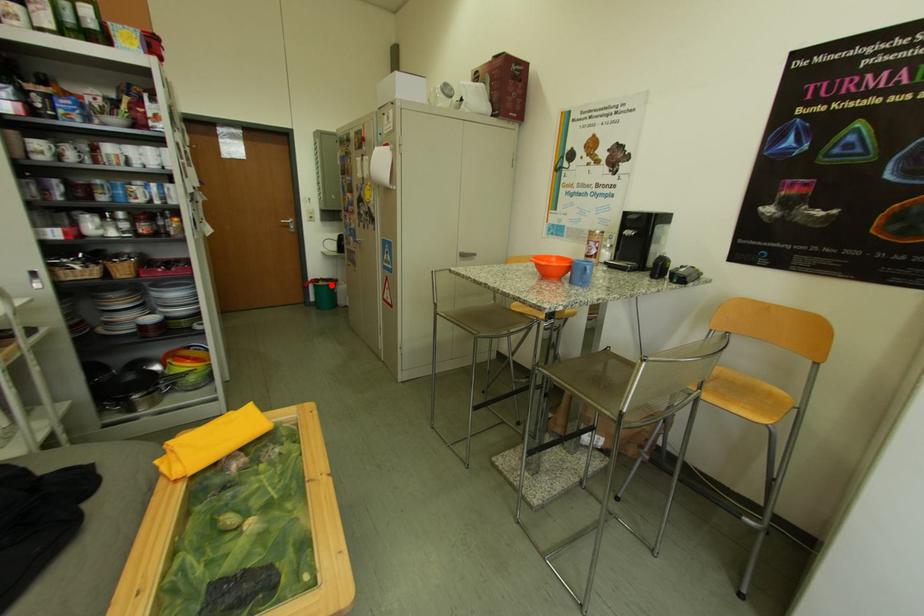
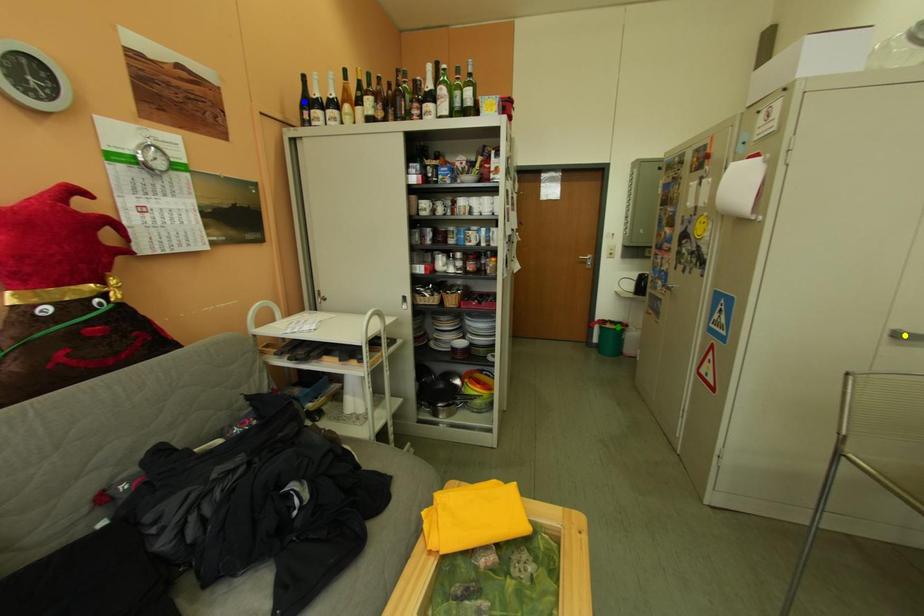
Question: I am providing you with two images of the same scene from different viewpoints. A red point is marked on the first image. You are given multiple points on the second image. Which spot in image 2 lines up with the point in image 1?

Choices:
 (A) blue point
 (B) green point
 (C) yellow point

Answer: (B)